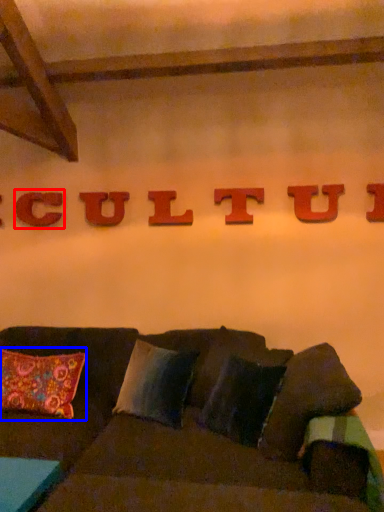
Question: Which point is closer to the camera, letter (highlighted by a red box) or pillow (highlighted by a blue box)?

Choices:
 (A) letter
 (B) pillow

Answer: (B)